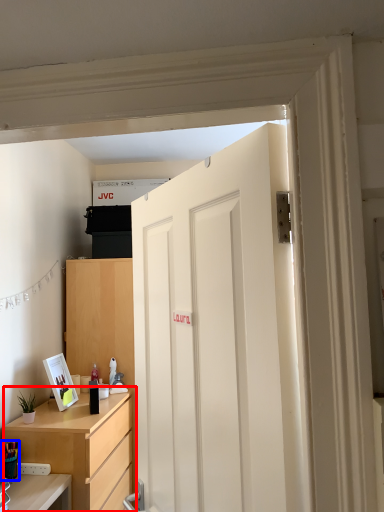
Question: Which object appears closest to the camera in this image, cabinetry (highlighted by a red box) or stationery (highlighted by a blue box)?

Choices:
 (A) cabinetry
 (B) stationery

Answer: (B)